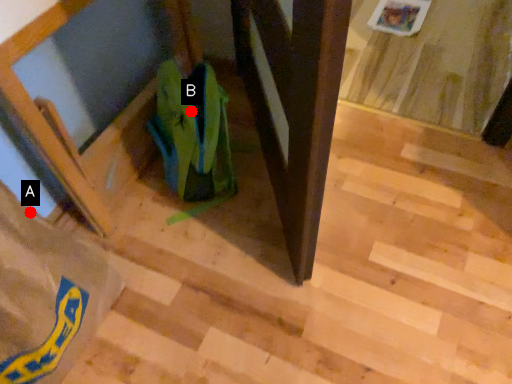
Question: Two points are circled on the image, labeled by A and B beside each circle. Which point is further to the camera?

Choices:
 (A) A is further
 (B) B is further

Answer: (B)